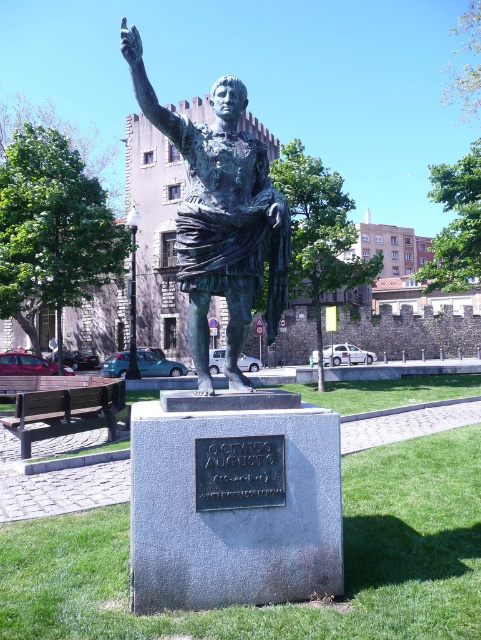
You are an art conservator assessing the space around the bronze statue at center and the black metal plaque at center. Which object is wider?

The bronze statue at center is wider than the black metal plaque at center.

You are a tour guide explaining the statue to visitors. You want to highlight the statue and its plaque. Which object is significantly taller between the bronze statue at center and the black metal plaque at center?

The bronze statue at center is much taller than the black metal plaque at center.